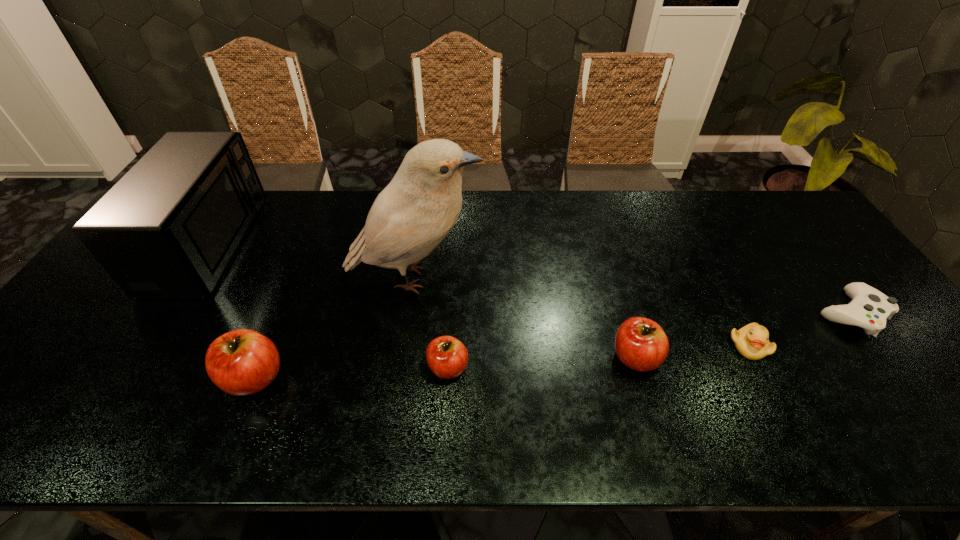
Identify the location of free space in the image that satisfies the following two spatial constraints: 1. on the front-facing side of the shortest object; 2. on the right side of the leftmost object. The image size is (960, 540). (163, 313).

Where is `vacant position in the image that satisfies the following two spatial constraints: 1. on the front-facing side of the shortest object; 2. on the left side of the sixth shortest object`? Image resolution: width=960 pixels, height=540 pixels. vacant position in the image that satisfies the following two spatial constraints: 1. on the front-facing side of the shortest object; 2. on the left side of the sixth shortest object is located at coordinates (163, 313).

Locate an element on the screen. This screenshot has width=960, height=540. vacant space that satisfies the following two spatial constraints: 1. on the face of the second apple from right to left; 2. on the right side of the tallest object is located at coordinates (402, 367).

The image size is (960, 540). Find the location of `free location that satisfies the following two spatial constraints: 1. on the front-facing side of the microwave_oven; 2. on the right side of the second shortest apple`. free location that satisfies the following two spatial constraints: 1. on the front-facing side of the microwave_oven; 2. on the right side of the second shortest apple is located at coordinates (135, 357).

At what (x,y) coordinates should I click in order to perform the action: click on vacant space that satisfies the following two spatial constraints: 1. on the face of the fifth tallest object; 2. on the right side of the parakeet. Please return your answer as a coordinate pair (x, y). Image resolution: width=960 pixels, height=540 pixels. Looking at the image, I should click on (402, 367).

Locate an element on the screen. The width and height of the screenshot is (960, 540). free space that satisfies the following two spatial constraints: 1. on the front-facing side of the leftmost object; 2. on the back side of the shortest object is located at coordinates (163, 313).

Locate an element on the screen. This screenshot has height=540, width=960. vacant space that satisfies the following two spatial constraints: 1. on the back side of the second apple from right to left; 2. on the face of the tallest object is located at coordinates (453, 279).

The height and width of the screenshot is (540, 960). In order to click on vacant position in the image that satisfies the following two spatial constraints: 1. on the front-facing side of the fourth shortest object; 2. on the right side of the leftmost object in this screenshot , I will do `click(135, 357)`.